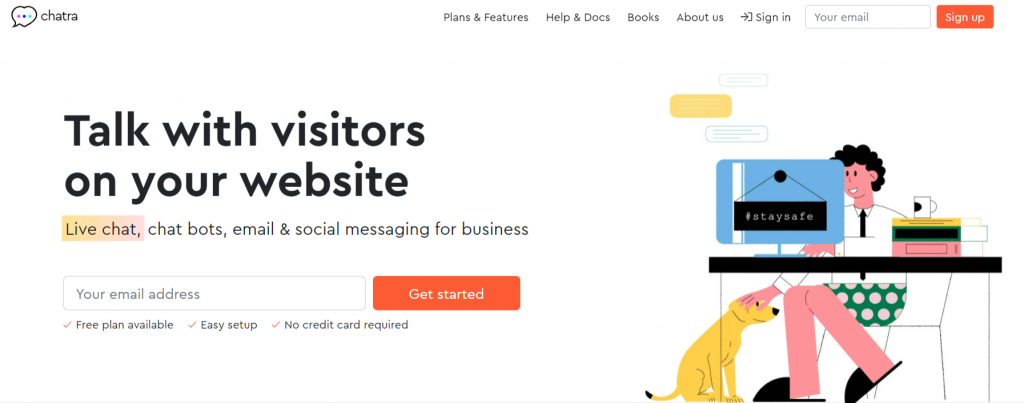
Where is `chair`? The height and width of the screenshot is (403, 1024). chair is located at coordinates (922, 297).